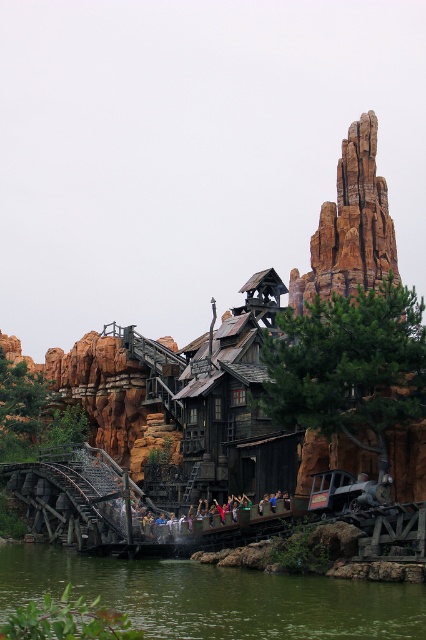
You are a visitor standing at the entrance of the amusement park and see the rustic stone rock formation at upper right in the distance. If you want to take a photo of it, would you need to use a zoom lens to capture it clearly?

The rustic stone rock formation at upper right is 183.27 meters away from camera. To capture it clearly from that distance, you would need to use a zoom lens.

You are standing at the entrance of the amusement park and see the wooden roller coaster at center and the green water at lower center. Which object is closer to you?

The wooden roller coaster at center is closer to you because it is further to the viewer than the green water at lower center.

You are a park visitor who wants to take a photo of the wooden roller coaster at center and the green water at lower center. Which object should you focus on first if you want to capture both in one shot without moving the camera?

The wooden roller coaster at center is wider than the green water at lower center, so you should focus on the wooden roller coaster at center first to ensure it fits in the frame before adjusting for the narrower green water at lower center.